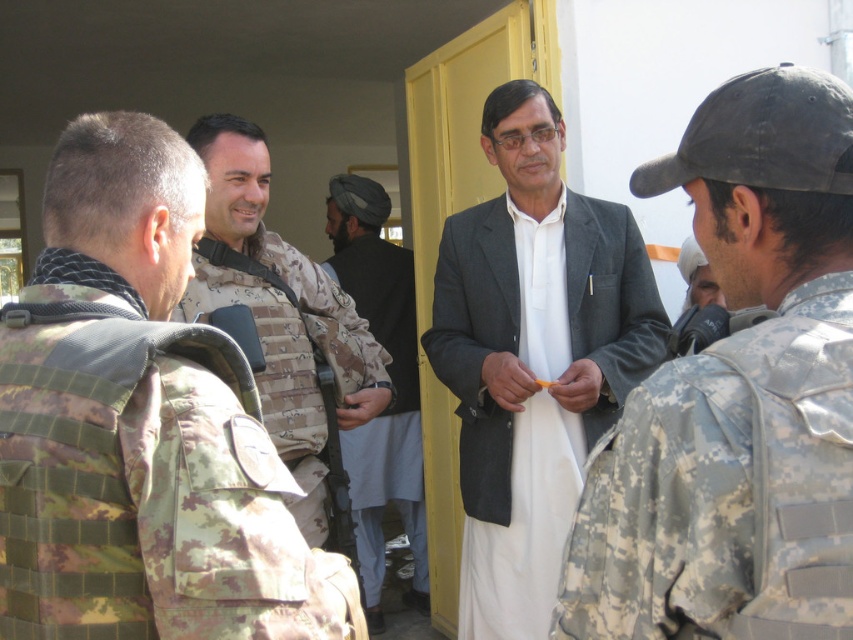
Question: Which of the following is the closest to the observer?

Choices:
 (A) white cotton shirt at center
 (B) dark brown woolen turban at center
 (C) camouflage fabric vest at center
 (D) camouflage fabric vest at left

Answer: (D)

Question: Among these points, which one is nearest to the camera?

Choices:
 (A) (318, 522)
 (B) (367, 492)
 (C) (843, 387)

Answer: (C)

Question: Is camouflage fabric vest at left above dark brown woolen turban at center?

Choices:
 (A) no
 (B) yes

Answer: (B)

Question: Can you confirm if camouflage fabric vest at left is positioned to the left of dark brown woolen turban at center?

Choices:
 (A) yes
 (B) no

Answer: (A)

Question: Where is camouflage fabric uniform at center located in relation to white cotton shirt at center in the image?

Choices:
 (A) below
 (B) above

Answer: (B)

Question: Which object appears farthest from the camera in this image?

Choices:
 (A) camouflage fabric uniform at center
 (B) camouflage fabric vest at left
 (C) white cotton shirt at center

Answer: (C)